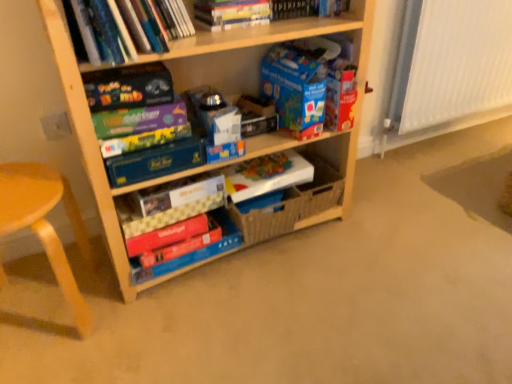
Question: From a real-world perspective, is wooden shelf at center physically located above or below white paper at center, which is counted as the third paperback book, starting from the bottom?

Choices:
 (A) above
 (B) below

Answer: (A)

Question: From their relative heights in the image, would you say wooden shelf at center is taller or shorter than white paper at center, arranged as the 6th paperback book when viewed from the top?

Choices:
 (A) short
 (B) tall

Answer: (B)

Question: Which object is the closest to the matte black board game at upper left, the 7th paperback book from the bottom?

Choices:
 (A) wooden at left
 (B) blue cardboard box at upper center, positioned as the 1th paperback book in top-to-bottom order
 (C) wooden shelf at center
 (D) matte red book at center, the first paperback book when ordered from bottom to top
 (E) matte board game at upper left, placed as the 3th paperback book when sorted from top to bottom

Answer: (E)

Question: Which is nearer to the hardcover book at upper center, placed as the second book when sorted from top to bottom?

Choices:
 (A) matte black board game at upper left, the 7th paperback book from the bottom
 (B) white paper at center, arranged as the 6th paperback book when viewed from the top
 (C) matte board game at upper left, which is the sixth paperback book from bottom to top
 (D) multicolored cardboard game box at center, the fourth paperback book in the top-to-bottom sequence
 (E) hardcover book at upper center, which is counted as the 1th book, starting from the top

Answer: (E)